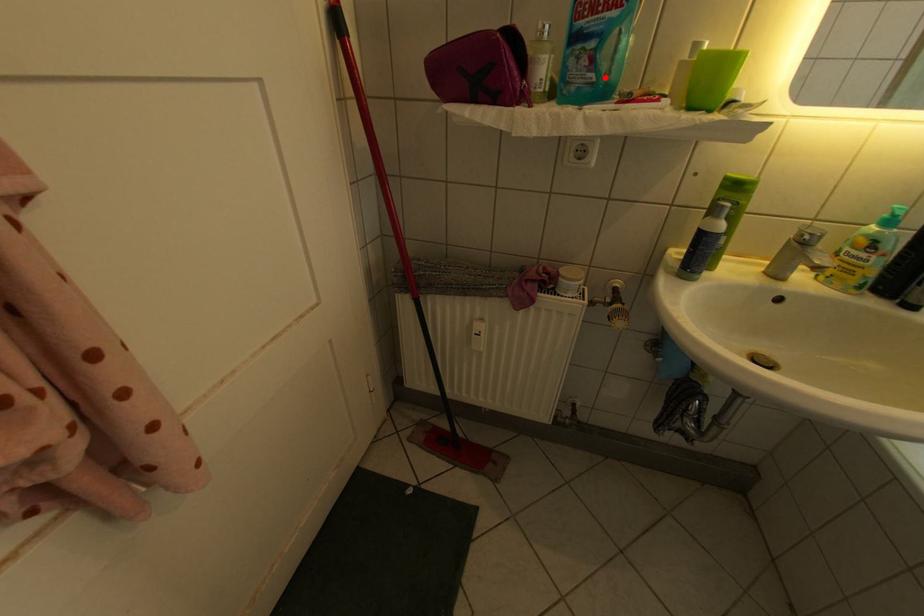
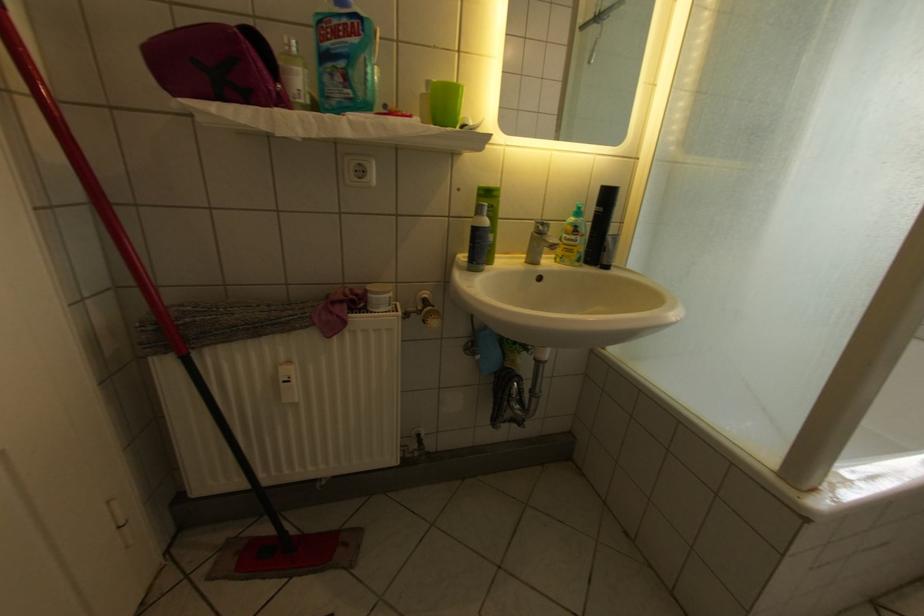
In the second image, find the point that corresponds to the highlighted location in the first image.

(360, 92)